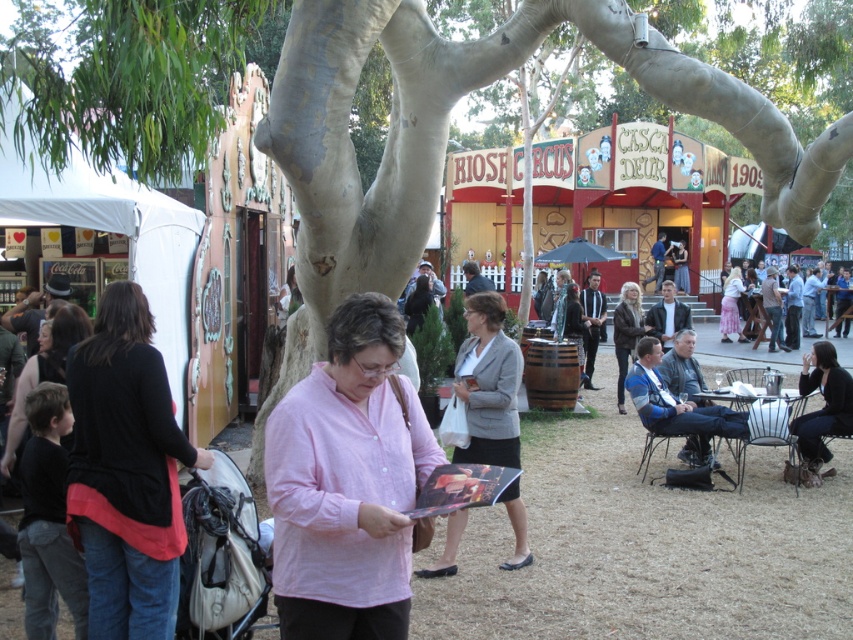
You are a photographer standing in the fairground and want to take a photo of both the black matte jacket at left and the leather jacket at center. However, you notice that one is blocking the other. Which jacket is currently blocking the other?

The black matte jacket at left is in front of the leather jacket at center, so it is blocking the leather jacket at center from view.

You are standing in the fairground and see the pink cotton shirt at center. Can you determine its exact coordinates in the image?

The pink cotton shirt at center is located at point (347, 483).